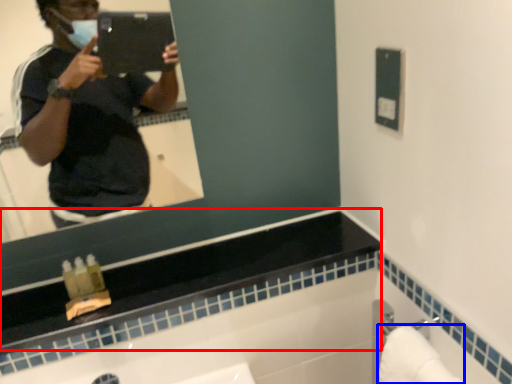
Question: Which object appears farthest to the camera in this image, counter top (highlighted by a red box) or towel bar (highlighted by a blue box)?

Choices:
 (A) counter top
 (B) towel bar

Answer: (A)